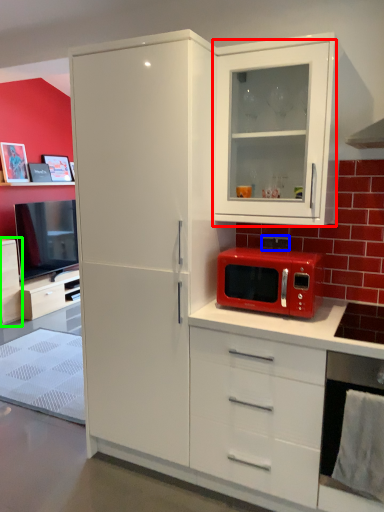
Question: Which object is positioned farthest from cabinetry (highlighted by a red box)? Select from corded phone (highlighted by a blue box) and cabinetry (highlighted by a green box).

Choices:
 (A) corded phone
 (B) cabinetry

Answer: (B)